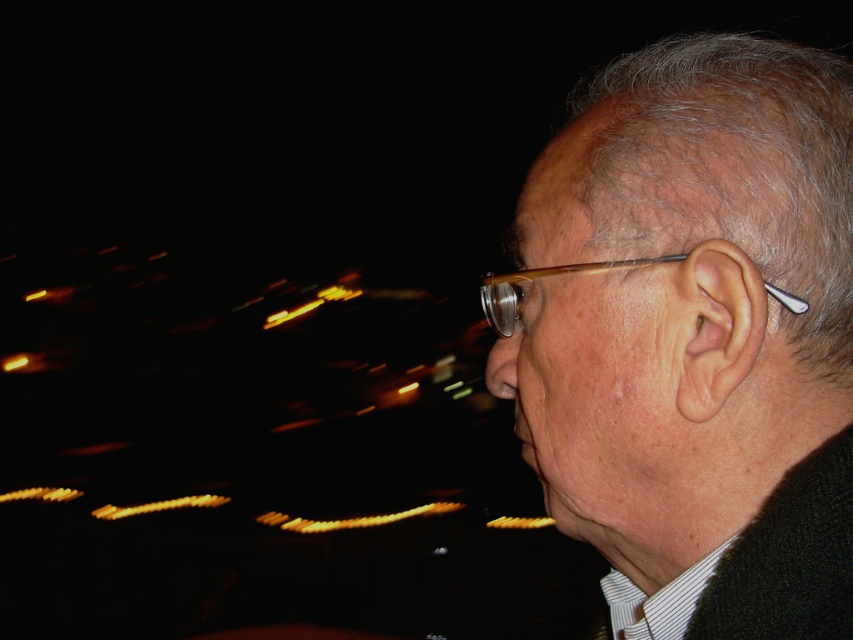
Question: Which point is closer to the camera?

Choices:
 (A) matte brown glasses at ear
 (B) matte black earbud at right

Answer: (B)

Question: Which point is closer to the camera taking this photo?

Choices:
 (A) (618, 385)
 (B) (563, 268)

Answer: (A)

Question: Is matte black earbud at right positioned at the back of matte brown glasses at ear?

Choices:
 (A) yes
 (B) no

Answer: (B)

Question: Where is matte black earbud at right located in relation to matte brown glasses at ear in the image?

Choices:
 (A) left
 (B) right

Answer: (B)

Question: Does matte black earbud at right have a smaller size compared to matte brown glasses at ear?

Choices:
 (A) no
 (B) yes

Answer: (A)